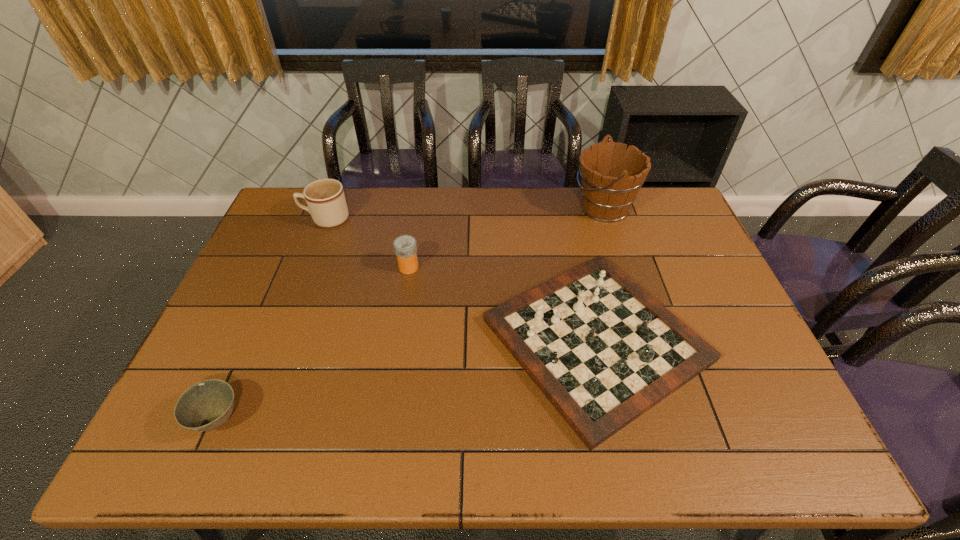
You are a GUI agent. You are given a task and a screenshot of the screen. Output one action in this format:
    pyautogui.click(x=<x>, y=<y>)
    Task: Click on the object that is at the far left corner
    This screenshot has height=540, width=960.
    Given the screenshot: What is the action you would take?
    pyautogui.click(x=325, y=198)

The image size is (960, 540). I want to click on object at the near left corner, so click(x=206, y=405).

Identify the location of object at the far right corner. This screenshot has height=540, width=960. (611, 178).

Where is `object that is at the near right corner`? The width and height of the screenshot is (960, 540). object that is at the near right corner is located at coordinates (603, 351).

The image size is (960, 540). In order to click on free region at the far edge in this screenshot , I will do `click(486, 207)`.

Image resolution: width=960 pixels, height=540 pixels. What are the coordinates of `vacant region at the near edge of the desktop` in the screenshot? It's located at pyautogui.click(x=438, y=426).

In the image, there is a desktop. Identify the location of vacant area at the left edge. (265, 255).

Locate an element on the screen. vacant region at the right edge of the desktop is located at coordinates (732, 414).

What are the coordinates of `free space at the far left corner of the desktop` in the screenshot? It's located at (289, 221).

Find the location of `empty location between the wine bucket and the fourth shortest object`. empty location between the wine bucket and the fourth shortest object is located at coordinates (465, 213).